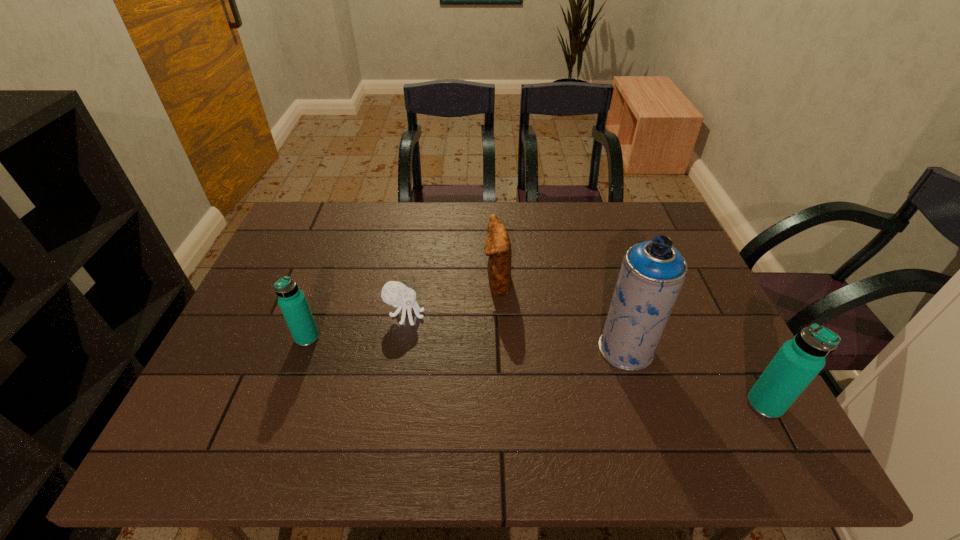
At what (x,y) coordinates should I click in order to perform the action: click on vacant space at the far edge. Please return your answer as a coordinate pair (x, y). The image size is (960, 540). Looking at the image, I should click on (593, 208).

I want to click on vacant space at the near edge of the desktop, so click(686, 407).

Identify the location of vacant region at the left edge of the desktop. The height and width of the screenshot is (540, 960). (274, 287).

You are a GUI agent. You are given a task and a screenshot of the screen. Output one action in this format:
    pyautogui.click(x=<x>, y=<y>)
    Task: Click on the vacant space at the right edge of the desktop
    The height and width of the screenshot is (540, 960).
    Given the screenshot: What is the action you would take?
    pyautogui.click(x=694, y=286)

Image resolution: width=960 pixels, height=540 pixels. What are the coordinates of `vacant region at the far left corner of the desktop` in the screenshot? It's located at (334, 218).

Locate an element on the screen. Image resolution: width=960 pixels, height=540 pixels. vacant region at the near right corner of the desktop is located at coordinates (716, 407).

Locate an element on the screen. The height and width of the screenshot is (540, 960). blank region between the third object from right to left and the shortest object is located at coordinates (451, 299).

Where is `free area in between the fourth object from left to right and the nearer water bottle`? This screenshot has width=960, height=540. free area in between the fourth object from left to right and the nearer water bottle is located at coordinates (695, 377).

Identify the location of free spot between the nearest object and the aerosol can. The height and width of the screenshot is (540, 960). coord(695,377).

Locate an element on the screen. The image size is (960, 540). free space between the fourth nearest object and the third object from right to left is located at coordinates (451, 299).